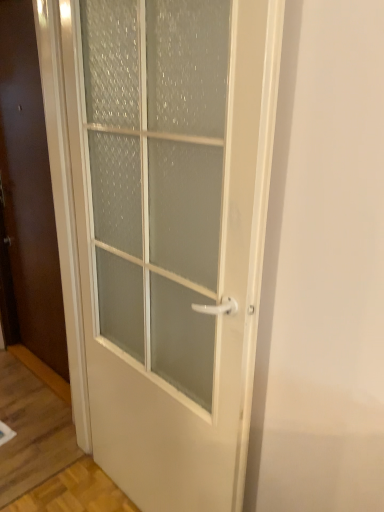
Question: Considering the positions of white frosted glass door at center, which is counted as the second door, starting from the left, and white glossy door at center, which is counted as the first door, starting from the left, in the image, is white frosted glass door at center, which is counted as the second door, starting from the left, wider or thinner than white glossy door at center, which is counted as the first door, starting from the left,?

Choices:
 (A) wide
 (B) thin

Answer: (A)

Question: From the image's perspective, is white frosted glass door at center, which is the first door from right to left, positioned above or below white glossy door at center, positioned as the second door in front-to-back order?

Choices:
 (A) below
 (B) above

Answer: (A)

Question: In terms of height, does white frosted glass door at center, acting as the second door starting from the back, look taller or shorter compared to white glossy door at center, which is the 2th door in right-to-left order?

Choices:
 (A) short
 (B) tall

Answer: (A)

Question: Considering the positions of white glossy door at center, the first door from the back, and white frosted glass door at center, the first door from the front, in the image, is white glossy door at center, the first door from the back, wider or thinner than white frosted glass door at center, the first door from the front,?

Choices:
 (A) thin
 (B) wide

Answer: (A)

Question: Based on their sizes in the image, would you say white glossy door at center, positioned as the second door in front-to-back order, is bigger or smaller than white frosted glass door at center, the first door from the front?

Choices:
 (A) big
 (B) small

Answer: (B)

Question: Considering the positions of point (21, 278) and point (188, 88), is point (21, 278) closer or farther from the camera than point (188, 88)?

Choices:
 (A) closer
 (B) farther

Answer: (B)

Question: From the image's perspective, is white glossy door at center, which is the 2th door in right-to-left order, located above or below white frosted glass door at center, the first door from the front?

Choices:
 (A) below
 (B) above

Answer: (B)